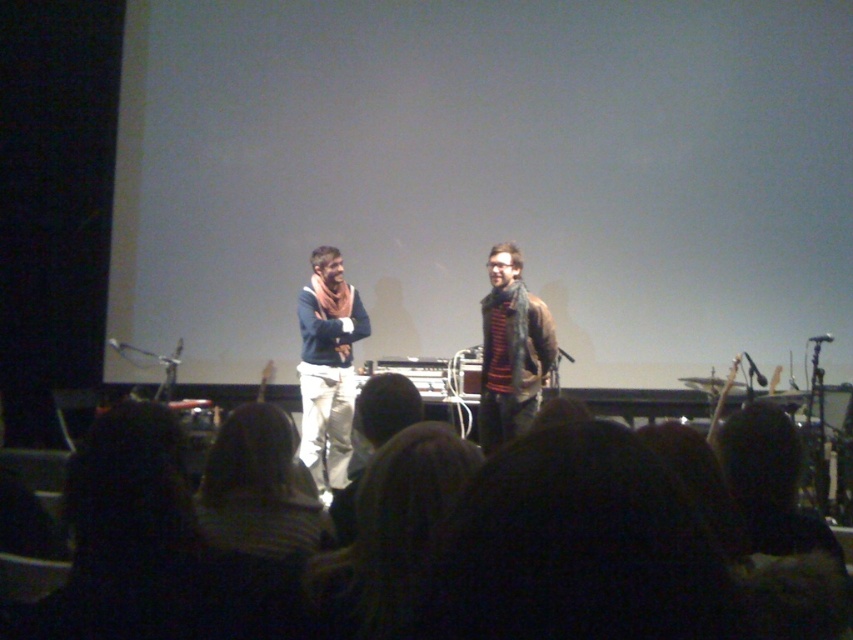
You are an audience member sitting in the front row. You notice two sweaters on stage at center. Which sweater is closer to the ground, the matte blue sweater at center or the striped knit sweater at center?

The matte blue sweater at center is positioned under the striped knit sweater at center, so the matte blue sweater at center is closer to the ground.

You are a stagehand who needs to place a 3.5 feet wide banner between the matte blue sweater at center and the striped knit sweater at center. Can you fit it there?

The distance between the matte blue sweater at center and the striped knit sweater at center is 3.57 feet, so yes, the banner can fit as it is slightly narrower than the space available.

Based on the coordinates provided, which object is located at point (328, 365)?

The point (328, 365) corresponds to the matte blue sweater at center.